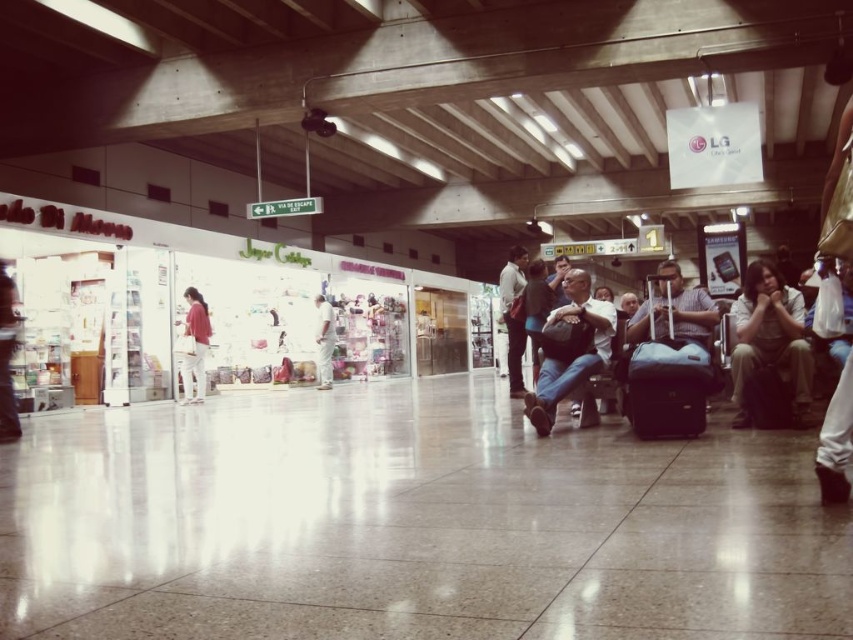
Who is higher up, matte black bag at center or matte red shirt at center?

matte black bag at center

Is point (575, 340) positioned before point (184, 289)?

That is True.

Image resolution: width=853 pixels, height=640 pixels. What do you see at coordinates (569, 348) in the screenshot? I see `matte black bag at center` at bounding box center [569, 348].

Where is `matte black bag at center`? The width and height of the screenshot is (853, 640). matte black bag at center is located at coordinates (569, 348).

Who is more forward, (756, 426) or (331, 317)?

Point (756, 426) is in front.

Can you confirm if black leather suitcase at right is positioned to the left of white cotton shirt at center?

No, black leather suitcase at right is not to the left of white cotton shirt at center.

At what (x,y) coordinates should I click in order to perform the action: click on black leather suitcase at right. Please return your answer as a coordinate pair (x, y). Looking at the image, I should click on (767, 397).

Who is positioned more to the left, dark blue jeans at center or white cotton shirt at center?

white cotton shirt at center is more to the left.

Is point (534, 362) in front of point (318, 374)?

Yes.

Identify the location of dark blue jeans at center. (537, 308).